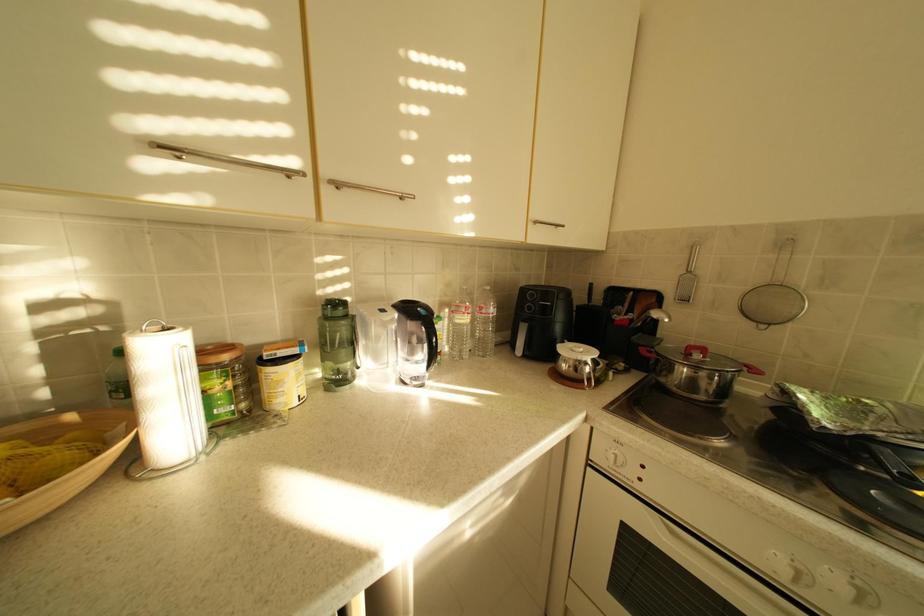
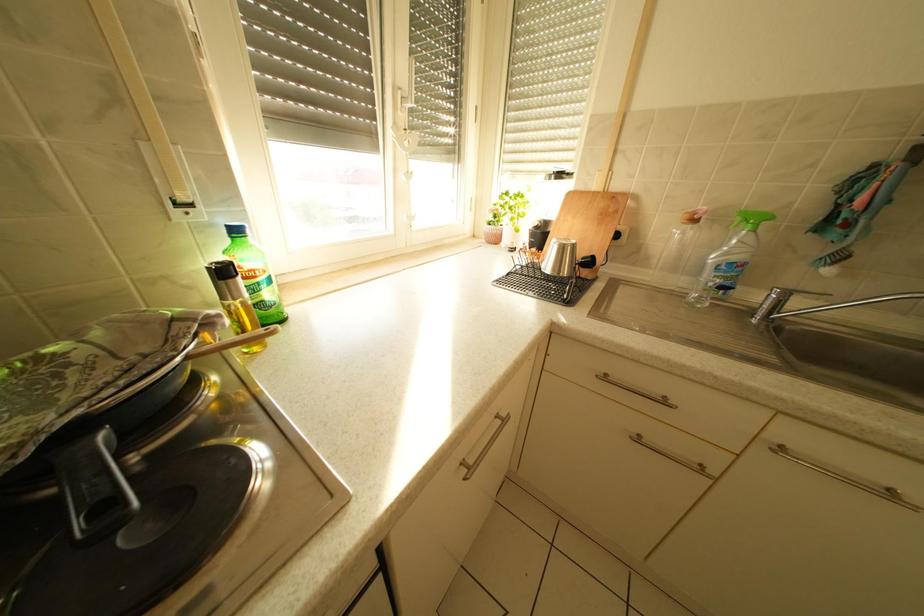
The first image is from the beginning of the video and the second image is from the end. How did the camera likely rotate when shooting the video?

The camera's rotation is toward right-down.